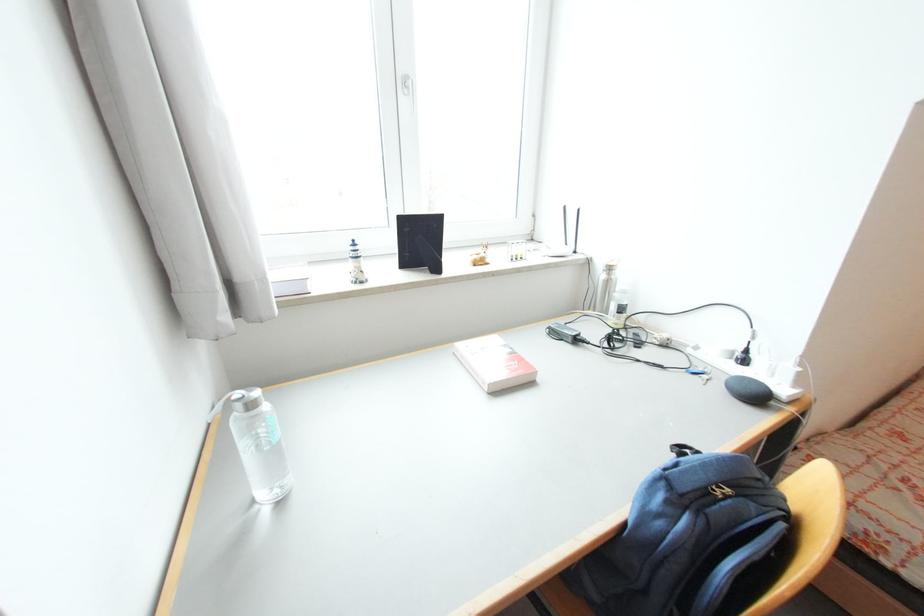
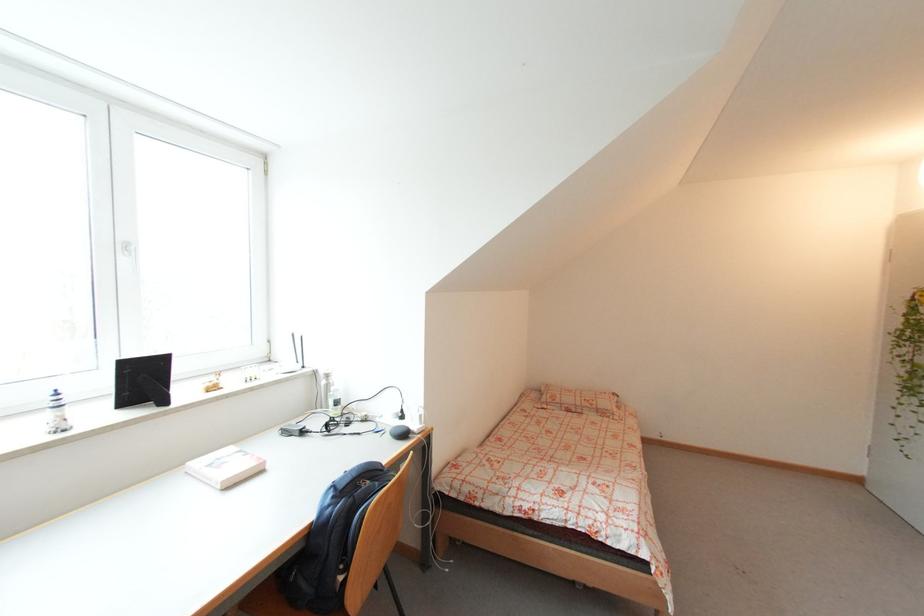
In the second image, find the point that corresponds to (734,387) in the first image.

(395, 435)